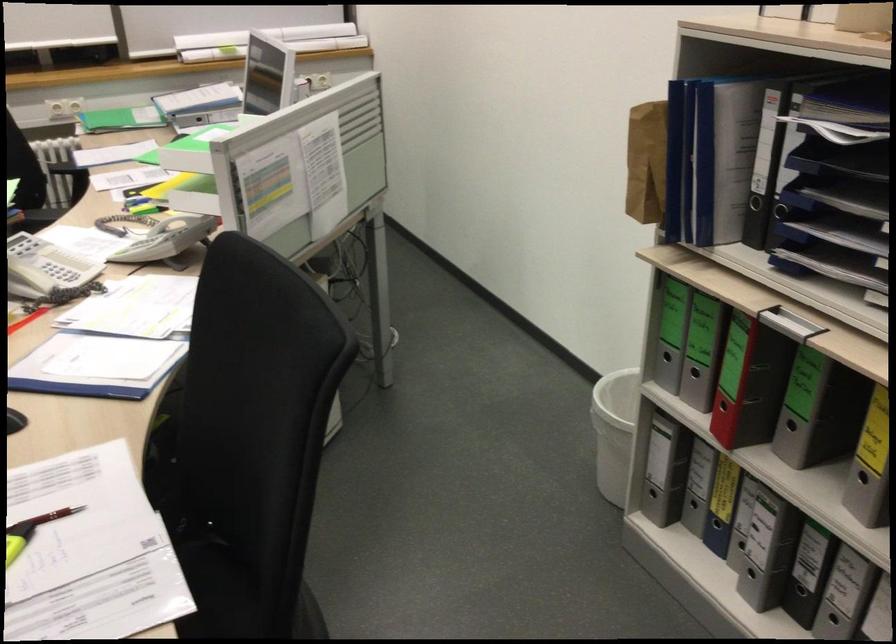
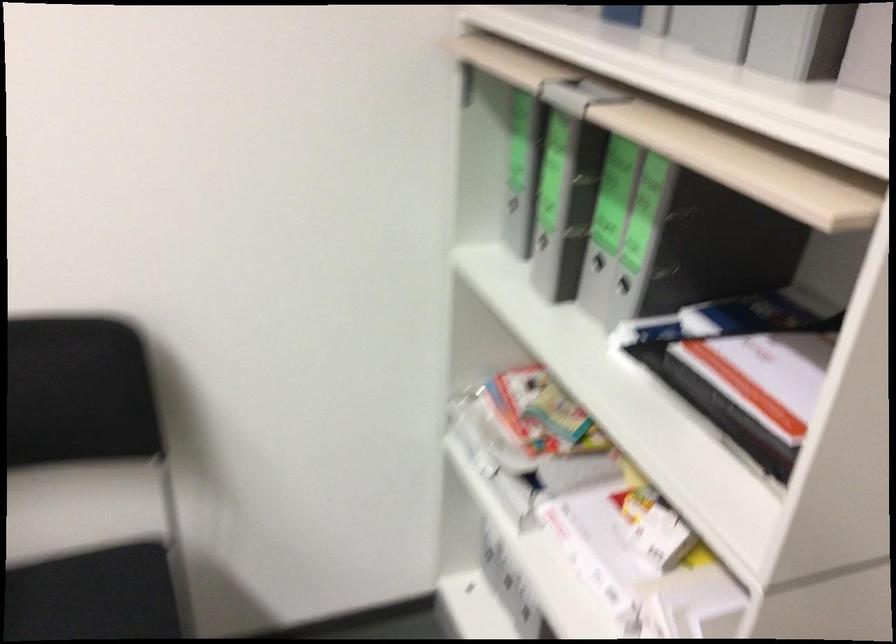
How did the camera likely rotate?

The camera rotated toward right-down.